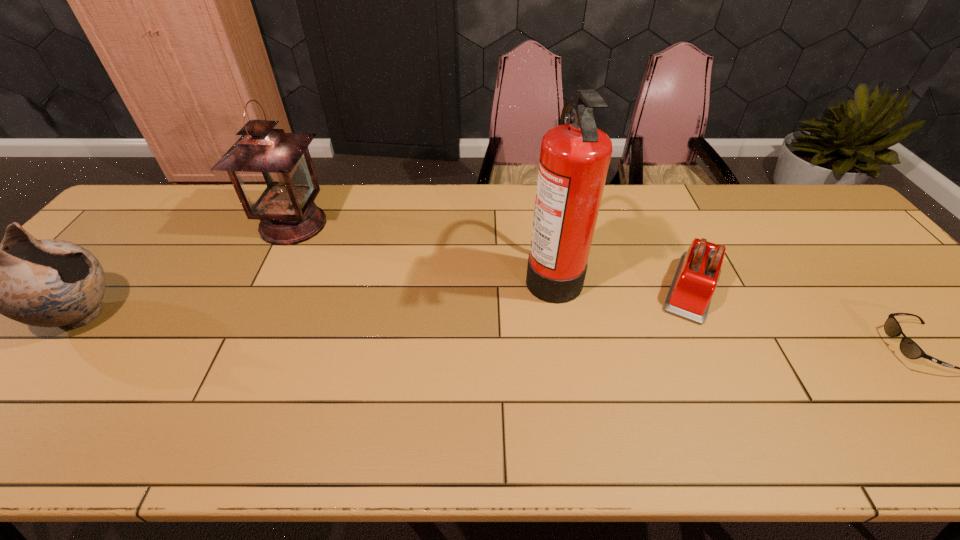
I want to click on the tallest object, so click(575, 156).

At what (x,y) coordinates should I click in order to perform the action: click on the third object from left to right. Please return your answer as a coordinate pair (x, y). Image resolution: width=960 pixels, height=540 pixels. Looking at the image, I should click on (575, 156).

At what (x,y) coordinates should I click in order to perform the action: click on the second object from left to right. Please return your answer as a coordinate pair (x, y). Image resolution: width=960 pixels, height=540 pixels. Looking at the image, I should click on (272, 172).

Where is `the second tallest object`? the second tallest object is located at coordinates (272, 172).

This screenshot has width=960, height=540. What are the coordinates of `pottery` in the screenshot? It's located at (48, 283).

Where is `the leftmost object`? the leftmost object is located at coordinates [x=48, y=283].

Locate an element on the screen. The height and width of the screenshot is (540, 960). toaster is located at coordinates (696, 278).

Locate an element on the screen. The height and width of the screenshot is (540, 960). the second object from right to left is located at coordinates (696, 278).

The width and height of the screenshot is (960, 540). In order to click on free space located 0.270m on the front-facing side of the fire extinguisher in this screenshot , I will do `click(426, 273)`.

At what (x,y) coordinates should I click in order to perform the action: click on blank space located 0.180m on the front-facing side of the fire extinguisher. Please return your answer as a coordinate pair (x, y). Looking at the image, I should click on (459, 273).